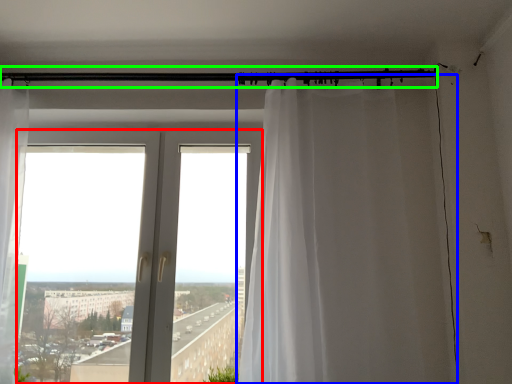
Question: Which object is the farthest from window (highlighted by a red box)? Choose among these: curtain (highlighted by a blue box) or beam (highlighted by a green box).

Choices:
 (A) curtain
 (B) beam

Answer: (B)